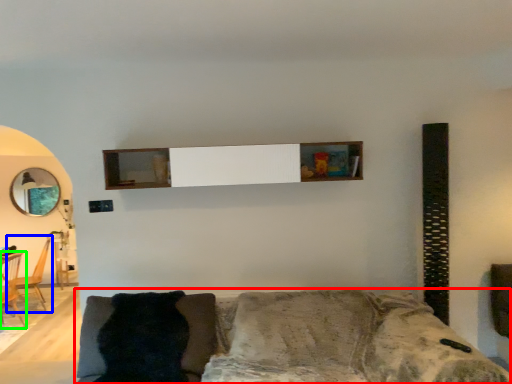
Question: Based on their relative distances, which object is nearer to studio couch (highlighted by a red box)? Choose from armchair (highlighted by a blue box) and armchair (highlighted by a green box).

Choices:
 (A) armchair
 (B) armchair

Answer: (B)